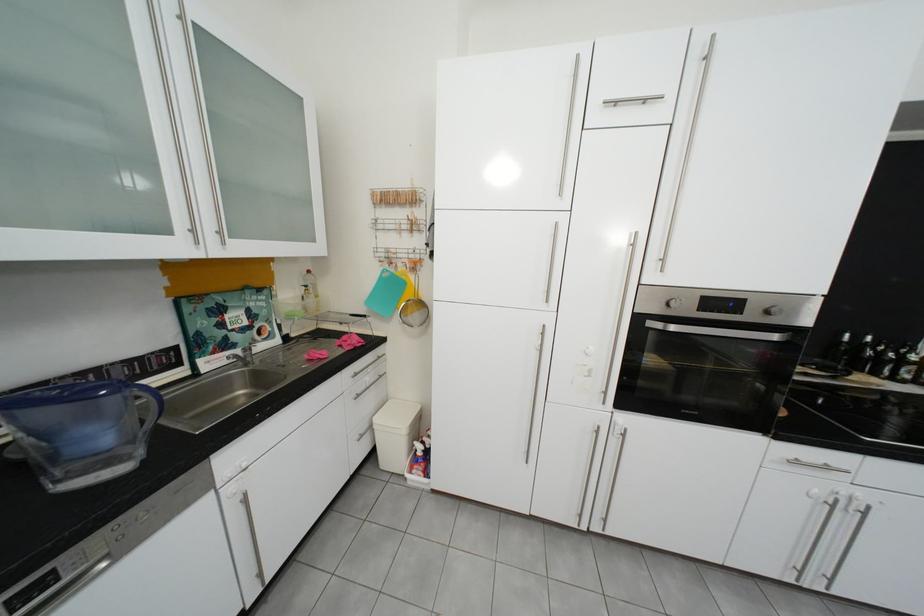
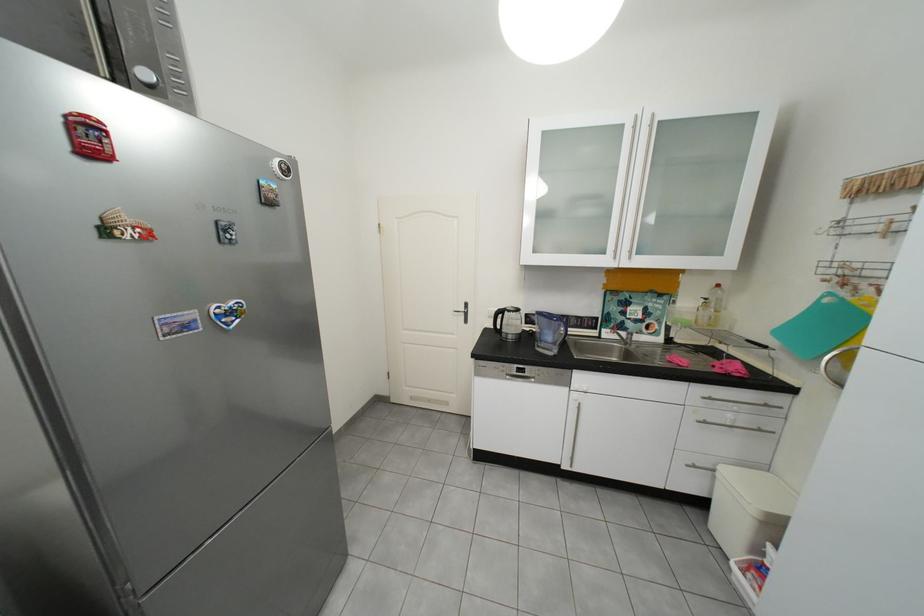
The point at [386,428] is marked in the first image. Where is the corresponding point in the second image?

(730, 476)